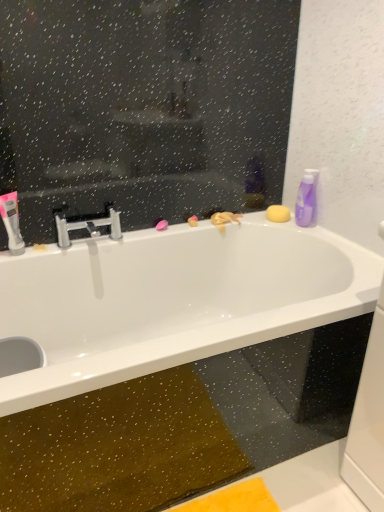
You are a GUI agent. You are given a task and a screenshot of the screen. Output one action in this format:
    pyautogui.click(x=<x>, y=<y>)
    Task: Click on the polished chrome faucet at center
    The image size is (384, 512).
    Given the screenshot: What is the action you would take?
    pyautogui.click(x=88, y=225)

At what (x,y) coordinates should I click in order to perform the action: click on white glossy toothpaste at left. Please return your answer as a coordinate pair (x, y). This screenshot has height=512, width=384. Looking at the image, I should click on (12, 222).

The image size is (384, 512). What do you see at coordinates (12, 222) in the screenshot?
I see `white glossy toothpaste at left` at bounding box center [12, 222].

Where is `purple glossy bottle at upper right`? This screenshot has height=512, width=384. purple glossy bottle at upper right is located at coordinates (306, 198).

From a real-world perspective, is purple glossy bottle at upper right physically above polished chrome faucet at center?

Yes.

In terms of height, does purple glossy bottle at upper right look taller or shorter compared to polished chrome faucet at center?

Clearly, purple glossy bottle at upper right is taller compared to polished chrome faucet at center.

Considering their positions, is purple glossy bottle at upper right located in front of or behind polished chrome faucet at center?

purple glossy bottle at upper right is behind polished chrome faucet at center.

Is point (302, 184) more distant than point (92, 233)?

Yes, point (302, 184) is behind point (92, 233).

Considering the positions of point (311, 183) and point (5, 219), is point (311, 183) closer or farther from the camera than point (5, 219)?

Point (311, 183) appears to be farther away from the viewer than point (5, 219).

From the image's perspective, does purple glossy bottle at upper right appear higher than white glossy toothpaste at left?

Yes, from the image's perspective, purple glossy bottle at upper right is on top of white glossy toothpaste at left.

Is purple glossy bottle at upper right positioned beyond the bounds of white glossy toothpaste at left?

purple glossy bottle at upper right lies outside white glossy toothpaste at left's area.

Could you tell me if polished chrome faucet at center is turned towards purple glossy bottle at upper right?

No, polished chrome faucet at center is not turned towards purple glossy bottle at upper right.

In the image, is polished chrome faucet at center positioned in front of or behind purple glossy bottle at upper right?

In the image, polished chrome faucet at center appears in front of purple glossy bottle at upper right.

Find the location of a particular element. This screenshot has height=512, width=384. tap below the purple glossy bottle at upper right (from the image's perspective) is located at coordinates (88, 225).

Can purple glossy bottle at upper right be found inside white glossy bathtub at upper center?

No, purple glossy bottle at upper right is not inside white glossy bathtub at upper center.

Is point (145, 315) positioned in front of point (318, 173)?

No, it is behind (318, 173).

In terms of size, does white glossy bathtub at upper center appear bigger or smaller than purple glossy bottle at upper right?

white glossy bathtub at upper center is bigger than purple glossy bottle at upper right.

Is white glossy bathtub at upper center facing towards purple glossy bottle at upper right?

No.

From a real-world perspective, is polished chrome faucet at center physically below white glossy bathtub at upper center?

No, from a real-world perspective, polished chrome faucet at center is not under white glossy bathtub at upper center.

Where is `bathtub in front of the polished chrome faucet at center`? The image size is (384, 512). bathtub in front of the polished chrome faucet at center is located at coordinates (172, 300).

Is polished chrome faucet at center touching white glossy bathtub at upper center?

No, polished chrome faucet at center is not in contact with white glossy bathtub at upper center.

Would you say polished chrome faucet at center is outside white glossy bathtub at upper center?

Yes, polished chrome faucet at center is located beyond the bounds of white glossy bathtub at upper center.

Can you confirm if purple glossy bottle at upper right is thinner than white glossy bathtub at upper center?

Indeed, purple glossy bottle at upper right has a lesser width compared to white glossy bathtub at upper center.

Based on the photo, who is bigger, purple glossy bottle at upper right or white glossy bathtub at upper center?

With larger size is white glossy bathtub at upper center.

From the image's perspective, which is below, purple glossy bottle at upper right or white glossy bathtub at upper center?

white glossy bathtub at upper center is shown below in the image.

Where is `tap that appears above the white glossy toothpaste at left (from the image's perspective)`? tap that appears above the white glossy toothpaste at left (from the image's perspective) is located at coordinates (88, 225).

From a real-world perspective, is polished chrome faucet at center positioned over white glossy toothpaste at left based on gravity?

No, from a real-world perspective, polished chrome faucet at center is not above white glossy toothpaste at left.

Who is bigger, polished chrome faucet at center or white glossy toothpaste at left?

With larger size is polished chrome faucet at center.

Is polished chrome faucet at center to the left of white glossy toothpaste at left from the viewer's perspective?

Incorrect, polished chrome faucet at center is not on the left side of white glossy toothpaste at left.

Find the location of a particular element. The image size is (384, 512). cleaning product that is above the polished chrome faucet at center (from a real-world perspective) is located at coordinates (306, 198).

At what (x,y) coordinates should I click in order to perform the action: click on mouthwash that is below the purple glossy bottle at upper right (from the image's perspective). Please return your answer as a coordinate pair (x, y). The image size is (384, 512). Looking at the image, I should click on (12, 222).

Considering their positions, is purple glossy bottle at upper right positioned further to white glossy bathtub at upper center than polished chrome faucet at center?

purple glossy bottle at upper right is further to white glossy bathtub at upper center.

Estimate the real-world distances between objects in this image. Which object is further from polished chrome faucet at center, white glossy toothpaste at left or white glossy bathtub at upper center?

Among the two, white glossy bathtub at upper center is located further to polished chrome faucet at center.

Considering their positions, is white glossy bathtub at upper center positioned further to purple glossy bottle at upper right than polished chrome faucet at center?

polished chrome faucet at center is positioned further to the anchor purple glossy bottle at upper right.

Considering their positions, is purple glossy bottle at upper right positioned closer to polished chrome faucet at center than white glossy bathtub at upper center?

white glossy bathtub at upper center lies closer to polished chrome faucet at center than the other object.

In the scene shown: From the image, which object appears to be nearer to white glossy bathtub at upper center, purple glossy bottle at upper right or white glossy toothpaste at left?

The object closer to white glossy bathtub at upper center is purple glossy bottle at upper right.

When comparing their distances from white glossy toothpaste at left, does white glossy bathtub at upper center or polished chrome faucet at center seem further?

The object further to white glossy toothpaste at left is white glossy bathtub at upper center.

Based on their spatial positions, is white glossy bathtub at upper center or white glossy toothpaste at left closer to purple glossy bottle at upper right?

Based on the image, white glossy bathtub at upper center appears to be nearer to purple glossy bottle at upper right.

Based on their spatial positions, is white glossy bathtub at upper center or purple glossy bottle at upper right closer to white glossy toothpaste at left?

The object closer to white glossy toothpaste at left is white glossy bathtub at upper center.

The image size is (384, 512). In order to click on bathtub situated between white glossy toothpaste at left and purple glossy bottle at upper right from left to right in this screenshot , I will do `click(172, 300)`.

The width and height of the screenshot is (384, 512). I want to click on tap between white glossy toothpaste at left and purple glossy bottle at upper right from left to right, so click(88, 225).

Find the location of `bathtub between polished chrome faucet at center and purple glossy bottle at upper right from left to right`. bathtub between polished chrome faucet at center and purple glossy bottle at upper right from left to right is located at coordinates (172, 300).

The height and width of the screenshot is (512, 384). I want to click on mouthwash located between white glossy bathtub at upper center and polished chrome faucet at center in the depth direction, so click(12, 222).